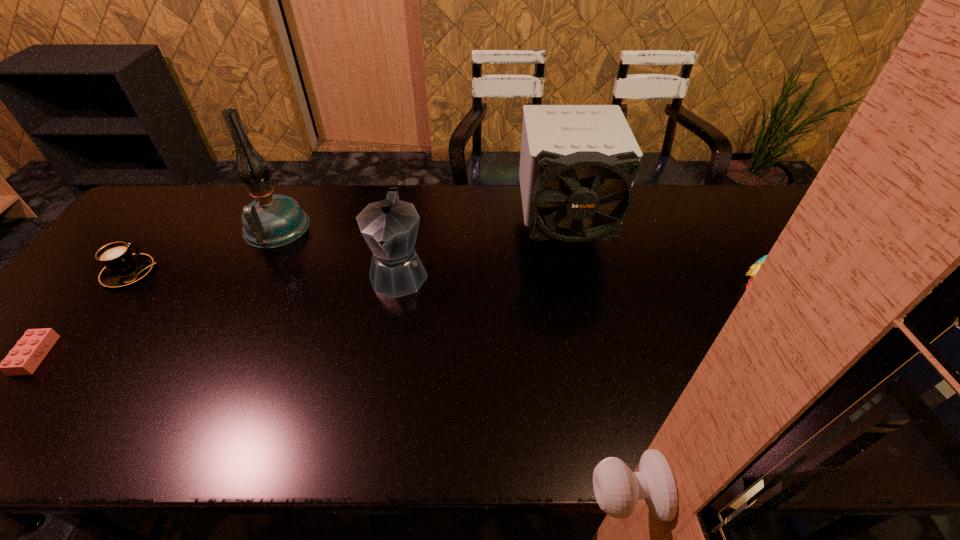
Locate an element on the screen. Image resolution: width=960 pixels, height=540 pixels. free space between the second shortest object and the fan is located at coordinates (x=347, y=251).

Where is `empty location between the cappuccino and the third object from left to right`? The width and height of the screenshot is (960, 540). empty location between the cappuccino and the third object from left to right is located at coordinates (203, 251).

Locate which object is the second closest to the Lego. Please provide its 2D coordinates. Your answer should be formatted as a tuple, i.e. [(x, y)], where the tuple contains the x and y coordinates of a point satisfying the conditions above.

[(272, 220)]

Identify the location of object that stands as the third closest to the fourth object from left to right. This screenshot has width=960, height=540. (122, 268).

Where is `vacant space that satisfies the following two spatial constraints: 1. on the back side of the fan; 2. on the left side of the cappuccino`? The image size is (960, 540). vacant space that satisfies the following two spatial constraints: 1. on the back side of the fan; 2. on the left side of the cappuccino is located at coordinates (162, 230).